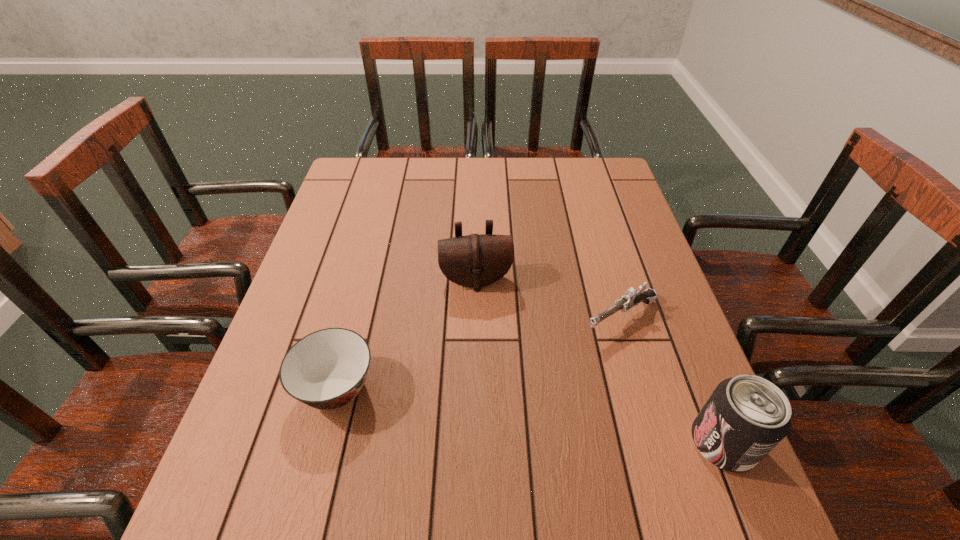
At what (x,y) coordinates should I click in order to perform the action: click on the leftmost object. Please return your answer as a coordinate pair (x, y). The image size is (960, 540). Looking at the image, I should click on (327, 369).

Locate an element on the screen. Image resolution: width=960 pixels, height=540 pixels. soda can is located at coordinates click(x=746, y=416).

At what (x,y) coordinates should I click in order to perform the action: click on the second object from left to right. Please return your answer as a coordinate pair (x, y). The image size is (960, 540). Looking at the image, I should click on (476, 260).

Identify the location of the farthest object. This screenshot has height=540, width=960. (476, 260).

At what (x,y) coordinates should I click in order to perform the action: click on gun. Please return your answer as a coordinate pair (x, y). Image resolution: width=960 pixels, height=540 pixels. Looking at the image, I should click on 632,297.

Locate an element on the screen. vacant space located on the left of the leftmost object is located at coordinates (261, 388).

This screenshot has width=960, height=540. What are the coordinates of `vacant region located 0.290m on the left of the soda can` in the screenshot? It's located at (535, 443).

Where is `free space located 0.230m with the flap open on the third object from right to left`? Image resolution: width=960 pixels, height=540 pixels. free space located 0.230m with the flap open on the third object from right to left is located at coordinates (491, 373).

The image size is (960, 540). I want to click on free space located 0.100m with the flap open on the third object from right to left, so click(484, 325).

This screenshot has height=540, width=960. I want to click on vacant space positioned with the flap open on the third object from right to left, so click(487, 342).